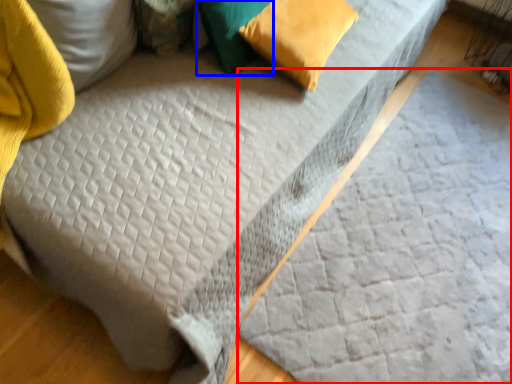
Question: Among these objects, which one is farthest to the camera, sheet (highlighted by a red box) or pillow (highlighted by a blue box)?

Choices:
 (A) sheet
 (B) pillow

Answer: (B)